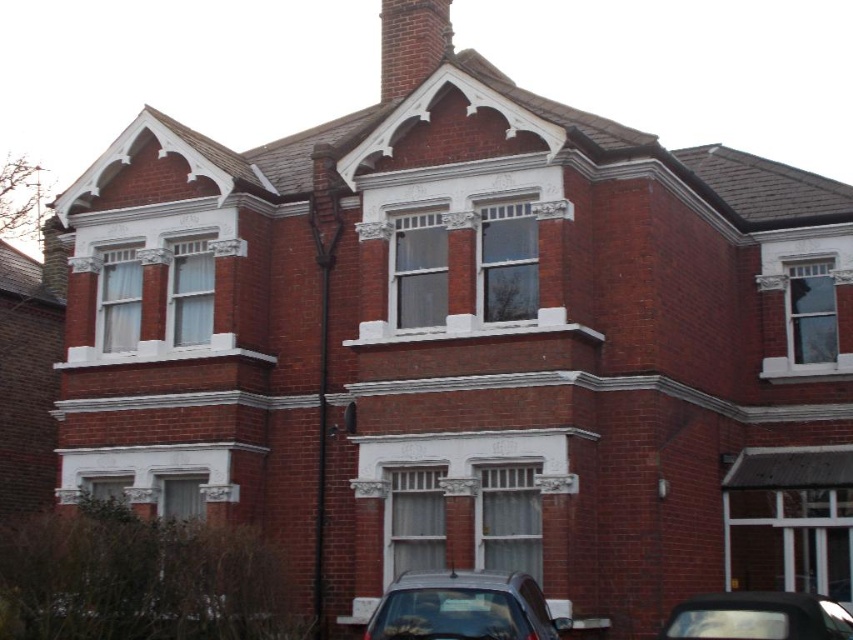
You are a delivery person approaching the house and need to park your vehicle. You see the shiny silver car at lower center and the shiny black car at lower right. Which car is blocking the driveway more?

The shiny silver car at lower center is positioned over the shiny black car at lower right, so it is blocking the driveway more.

You are standing in front of the two story brick house and want to determine which of the two points, point (440, 586) or point (769, 612), is closer to you. Which point is closer?

Point (440, 586) is closer to the camera than point (769, 612), so it is closer to you.

You are standing in front of the two story brick house and see the shiny silver car at lower center and the brick chimney at upper center. Which object is located to the right of the other?

The shiny silver car at lower center is positioned on the right side of brick chimney at upper center.